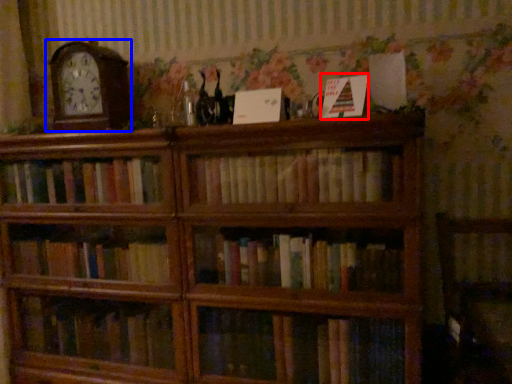
Question: Which object appears farthest to the camera in this image, paperback book (highlighted by a red box) or clock (highlighted by a blue box)?

Choices:
 (A) paperback book
 (B) clock

Answer: (B)